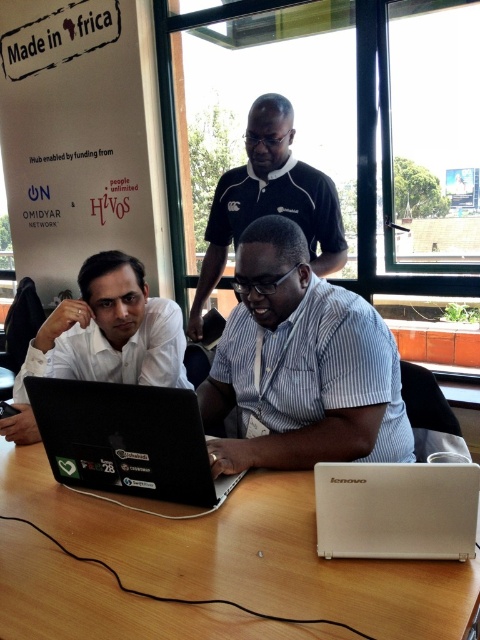
You are an office manager assessing the layout of the workspace. You notice the white matte shirt at left and the black polo shirt at center. Which individual is wearing a narrower shirt?

The white matte shirt at left is narrower than the black polo shirt at center.

You are organizing a meeting in this office and need to place a beige matte laptop at center on the wooden table at center. Can the laptop fit on the table without overhanging the edges?

The wooden table at center is wider than the beige matte laptop at center, so the laptop will fit without overhanging the edges.

You are a visitor in the office and want to approach the person wearing the white matte shirt at left to ask a question. Which direction should you move from the black polo shirt at center?

The white matte shirt at left is in front of the black polo shirt at center, so you should move forward from the black polo shirt at center to reach the white matte shirt at left.